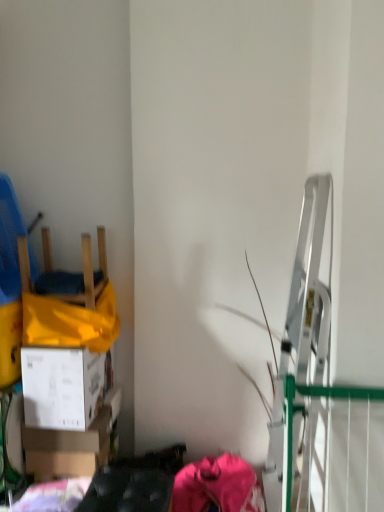
Question: Relative to wooden chair at left, is white cardboard box at lower left, placed as the second box when sorted from bottom to top, in front or behind?

Choices:
 (A) behind
 (B) front

Answer: (B)

Question: Does point (82, 423) appear closer or farther from the camera than point (9, 216)?

Choices:
 (A) closer
 (B) farther

Answer: (A)

Question: Which of these objects is positioned closest to the wooden chair at left?

Choices:
 (A) white cardboard box at lower left, which appears as the 1th box when viewed from the top
 (B) pink fabric at lower center
 (C) white cardboard box at lower left, arranged as the second box when viewed from the top

Answer: (A)

Question: Estimate the real-world distances between objects in this image. Which object is farther from the white cardboard box at lower left, arranged as the second box when viewed from the top?

Choices:
 (A) white cardboard box at lower left, which appears as the 1th box when viewed from the top
 (B) pink fabric at lower center
 (C) wooden chair at left

Answer: (C)